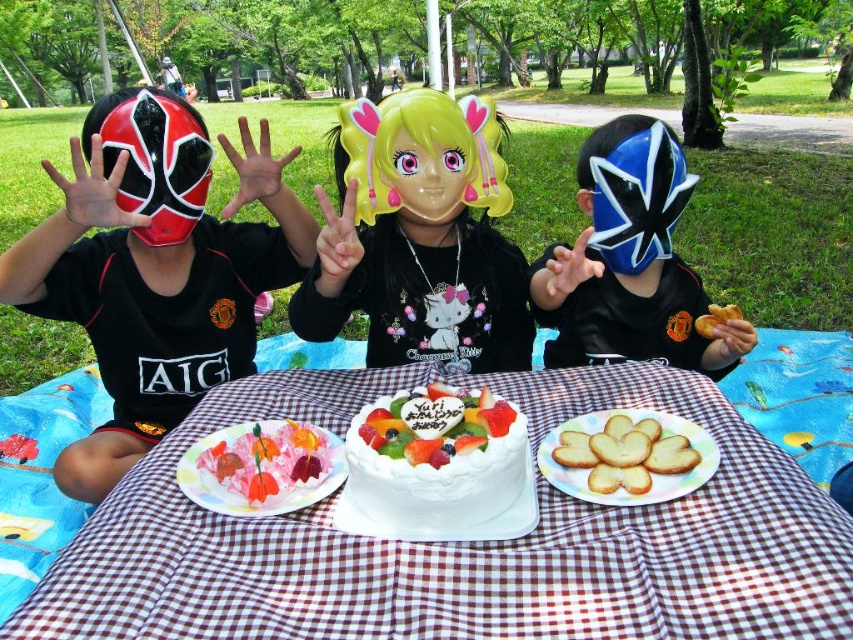
You are planning to place a small vase between the white frosted cake at center and the golden crispy bread at center. The vase is 15 inches wide. Will it fit between them without overlapping either item?

The white frosted cake at center and golden crispy bread at center are 33.64 inches apart. Since the vase is only 15 inches wide, there is enough space between them to place the vase without overlapping either item.

Consider the image. You are a photographer trying to capture a closeup of the white checkered tablecloth at center and the matte black mask at left. If you want to focus on the tablecloth, which object should you adjust your camera lens to focus on first, and why?

The white checkered tablecloth at center is shorter than the matte black mask at left, so you should focus on the matte black mask at left first because it is farther away and requires adjusting the lens to a longer focal length.

You are a photographer standing at the picnic table. You want to take a photo of the pink glossy cake at center. Where should you position your camera to ensure the point at coordinates point (x=262, y=467) is in the frame? The camera can only move along the picnic table. The picnic table is along the x axis from 0 to 1. The point is located at 0.731 on the x axis. The camera must be positioned such that the entire cake is visible. The cake is centered at 0.5 on the x axis and has a width of 0.4. The camera s

The camera should be positioned between 0.1 and 0.9 on the x axis to ensure the entire pink glossy cake at center is visible. Since the cake is centered at 0.5 with a width of 0.4, its edges are at 0.3 and 0.7 on the x axis. The point at 0.731 is slightly to the right of the cake s right edge at 0.7. To include this point, the camera must be positioned to the right of 0.7 but not beyond 0.9 to keep the entire cake in view.